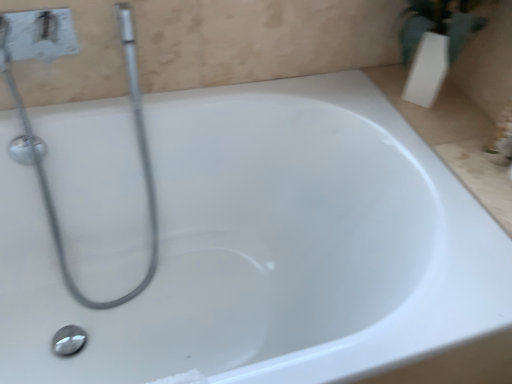
Question: From a real-world perspective, relative to satin chrome showerhead at upper left, is polished metallic shower drain at bottom left vertically above or below?

Choices:
 (A) below
 (B) above

Answer: (A)

Question: In the image, is polished metallic shower drain at bottom left positioned in front of or behind satin chrome showerhead at upper left?

Choices:
 (A) behind
 (B) front

Answer: (A)

Question: Considering the positions of polished metallic shower drain at bottom left and satin chrome showerhead at upper left in the image, is polished metallic shower drain at bottom left taller or shorter than satin chrome showerhead at upper left?

Choices:
 (A) tall
 (B) short

Answer: (B)

Question: From a real-world perspective, relative to polished metallic shower drain at bottom left, is satin chrome showerhead at upper left vertically above or below?

Choices:
 (A) above
 (B) below

Answer: (A)

Question: Is satin chrome showerhead at upper left wider or thinner than polished metallic shower drain at bottom left?

Choices:
 (A) wide
 (B) thin

Answer: (A)

Question: In terms of height, does satin chrome showerhead at upper left look taller or shorter compared to polished metallic shower drain at bottom left?

Choices:
 (A) tall
 (B) short

Answer: (A)

Question: Which is correct: satin chrome showerhead at upper left is inside polished metallic shower drain at bottom left, or outside of it?

Choices:
 (A) outside
 (B) inside

Answer: (A)